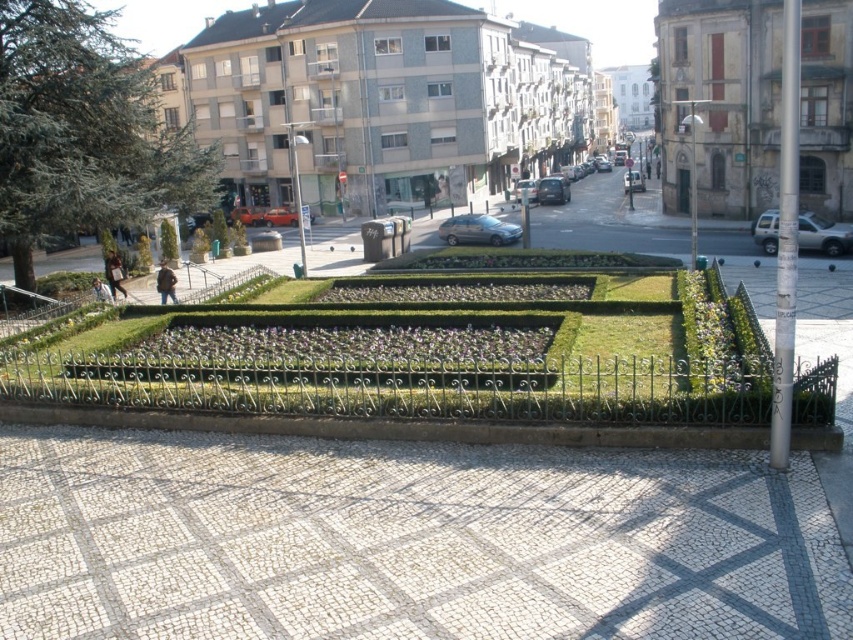
You are standing in the urban scene described. There is a point marked at coordinates [405,541] which corresponds to an object in the image. What object is located at this point?

The point at coordinates [405,541] indicates white mosaic tiles at center.

You are standing in the middle of the street looking towards the garden and the tiles. Which object is closer to you, the white mosaic tiles at center or the green grassy garden at center?

The white mosaic tiles at center are closer to the viewer than the green grassy garden at center according to the description.

You are a landscape architect designing a new public space. You want to incorporate both the green grassy garden at center and the green leafy plant at center into your design. Which of these two elements should you prioritize in terms of space allocation based on their current sizes?

The green grassy garden at center has a larger width than the green leafy plant at center, so you should prioritize allocating more space to the green grassy garden at center in your design.